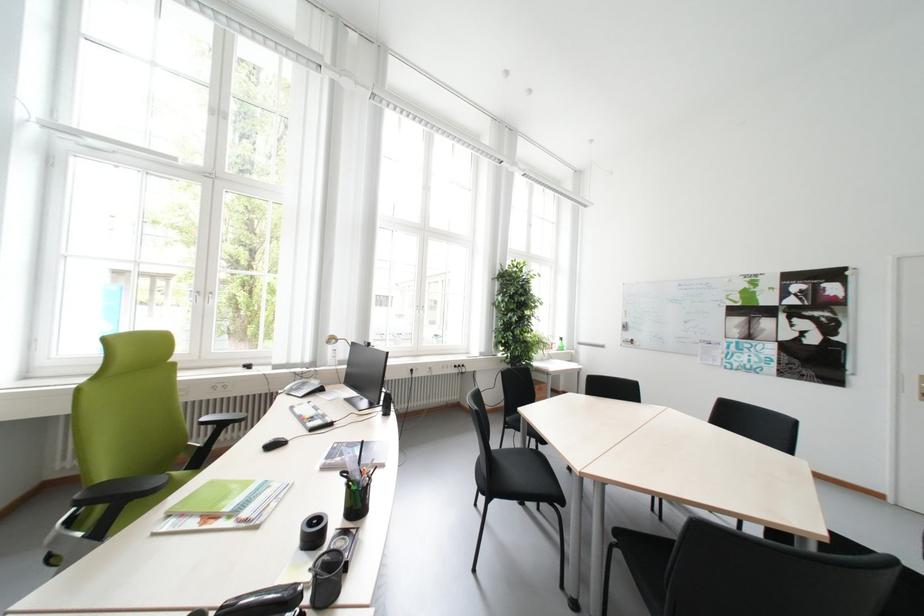
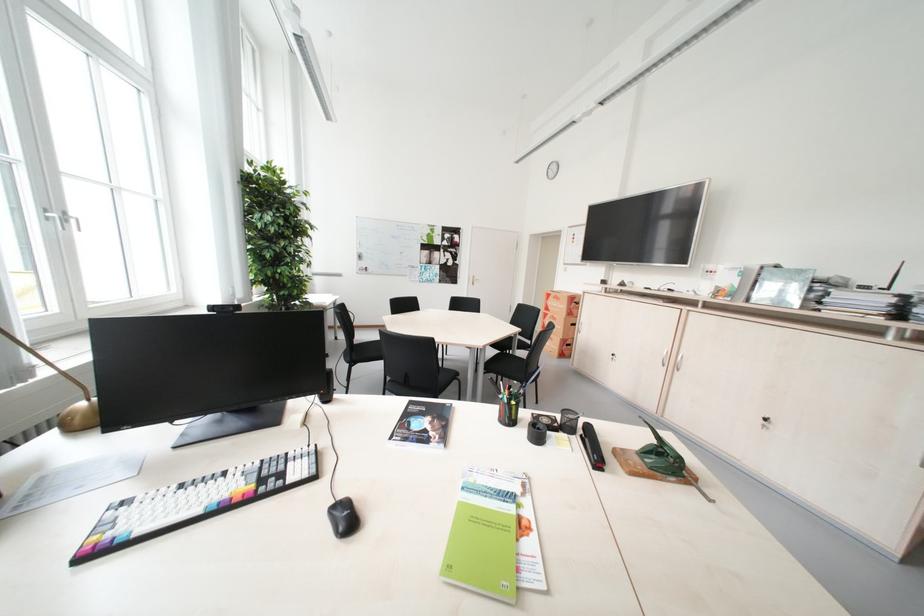
In the second image, find the point that corresponds to pixel 880 368 in the first image.

(473, 275)